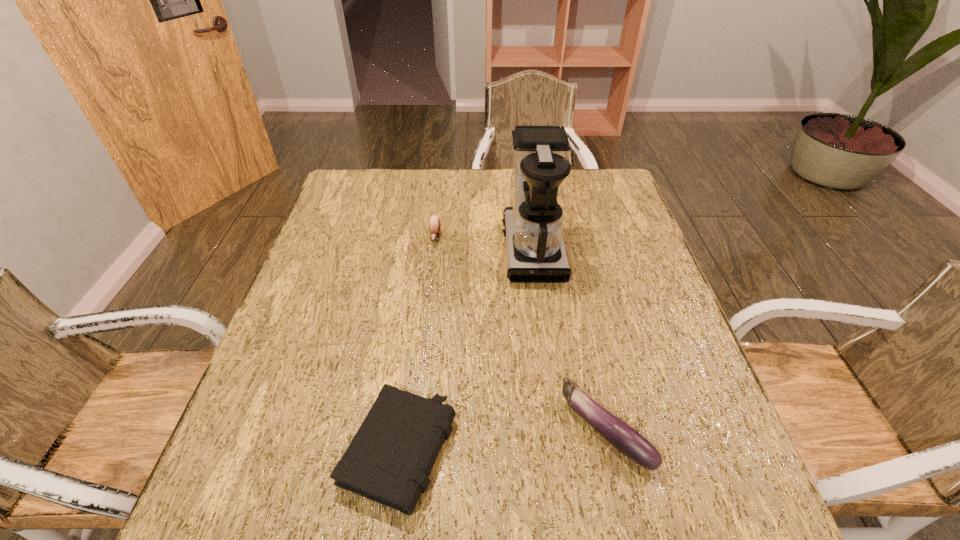
This screenshot has width=960, height=540. I want to click on free point that satisfies the following two spatial constraints: 1. on the front-facing side of the escargot; 2. on the right side of the eggplant, so click(x=413, y=430).

Locate an element on the screen. The width and height of the screenshot is (960, 540). vacant space that satisfies the following two spatial constraints: 1. at the front of the coffee maker where the controls are located; 2. on the left side of the eggplant is located at coordinates (556, 430).

Where is `vacant region that satisfies the following two spatial constraints: 1. at the front of the eggplant where the controls are located; 2. on the right side of the tallest object`? This screenshot has width=960, height=540. vacant region that satisfies the following two spatial constraints: 1. at the front of the eggplant where the controls are located; 2. on the right side of the tallest object is located at coordinates (556, 430).